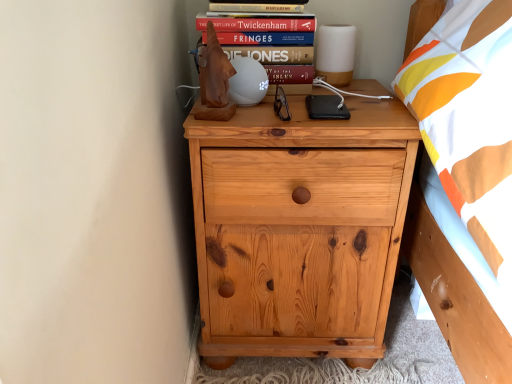
You are a GUI agent. You are given a task and a screenshot of the screen. Output one action in this format:
    pyautogui.click(x=<x>, y=<y>)
    Task: Click on the vacant point above hardcover book at upper center (from a real-world perspective)
    The height and width of the screenshot is (384, 512).
    Given the screenshot: What is the action you would take?
    pyautogui.click(x=257, y=11)